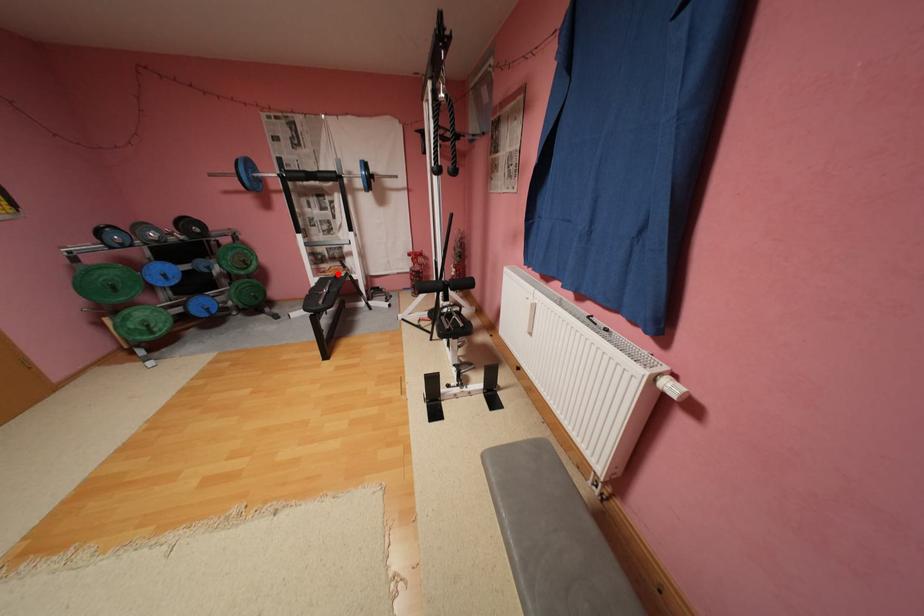
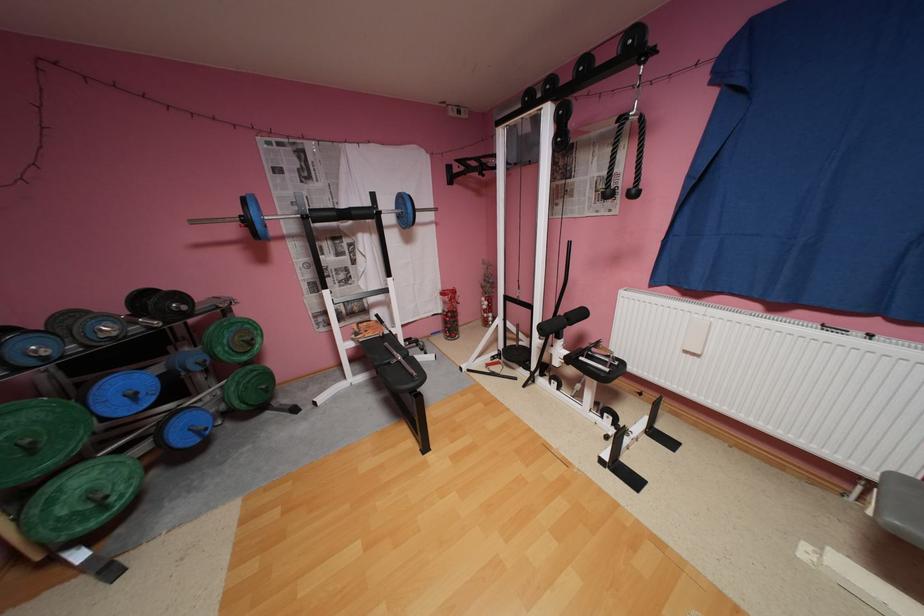
The point at the highlighted location is marked in the first image. Where is the corresponding point in the second image?

(380, 334)